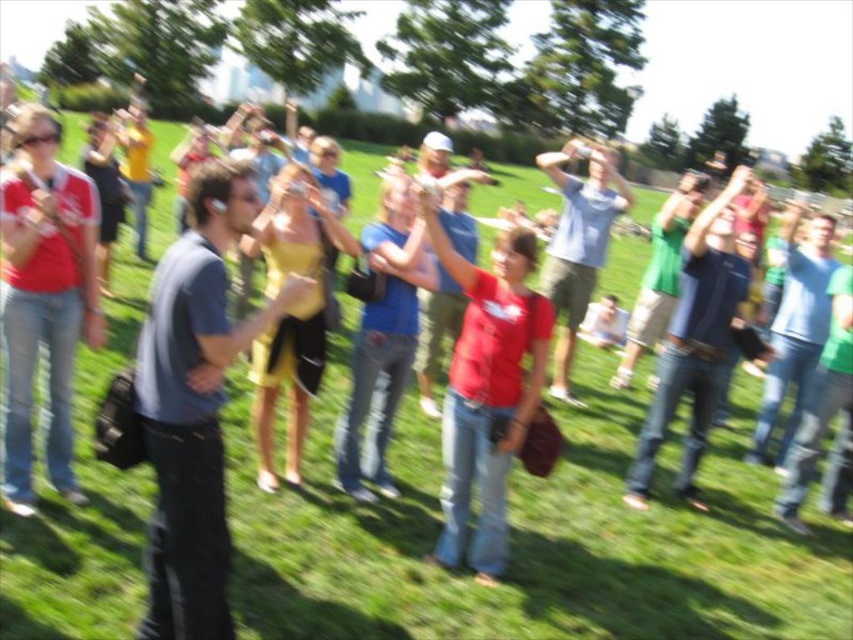
Question: Is dark gray shirt at center positioned before matte red shirt at center?

Choices:
 (A) yes
 (B) no

Answer: (A)

Question: Can you confirm if matte red shirt at left is bigger than yellow satin dress at center?

Choices:
 (A) no
 (B) yes

Answer: (A)

Question: Which point is closer to the camera?

Choices:
 (A) (457, 253)
 (B) (299, 224)

Answer: (B)

Question: Which point is farther to the camera?

Choices:
 (A) (18, 492)
 (B) (518, 365)
 (C) (166, 557)
 (D) (349, 237)

Answer: (D)

Question: Which point is closer to the camera?

Choices:
 (A) (67, 324)
 (B) (291, 387)

Answer: (A)

Question: Does dark gray shirt at center have a lesser width compared to yellow satin dress at center?

Choices:
 (A) no
 (B) yes

Answer: (B)